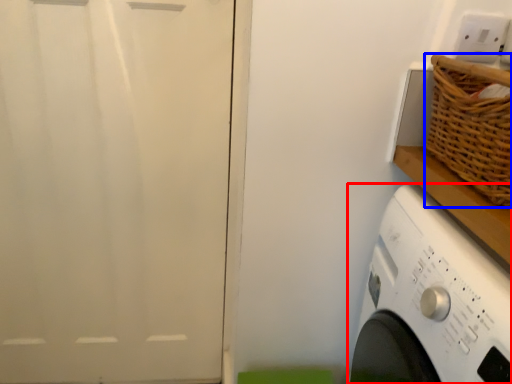
Question: Which object is further to the camera taking this photo, washing machine (highlighted by a red box) or basket (highlighted by a blue box)?

Choices:
 (A) washing machine
 (B) basket

Answer: (B)